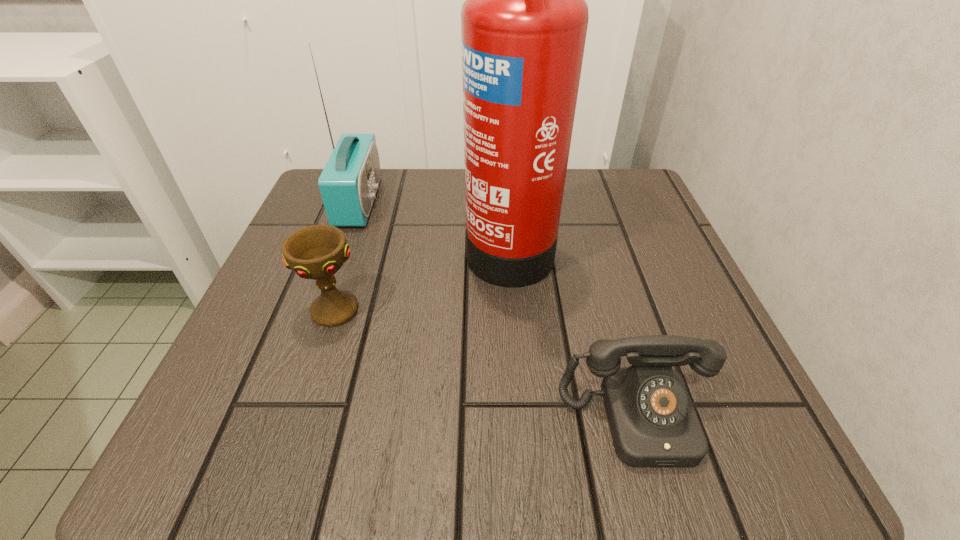
Where is `fire extinguisher located in the far edge section of the desktop`? The width and height of the screenshot is (960, 540). fire extinguisher located in the far edge section of the desktop is located at coordinates (523, 25).

Where is `radio receiver present at the far edge`? Image resolution: width=960 pixels, height=540 pixels. radio receiver present at the far edge is located at coordinates (348, 184).

You are a GUI agent. You are given a task and a screenshot of the screen. Output one action in this format:
    pyautogui.click(x=<x>, y=<y>)
    Task: Click on the object that is at the near edge
    The image size is (960, 540).
    Given the screenshot: What is the action you would take?
    pyautogui.click(x=653, y=422)

In order to click on radio receiver located at the left edge in this screenshot , I will do `click(348, 184)`.

You are a GUI agent. You are given a task and a screenshot of the screen. Output one action in this format:
    pyautogui.click(x=<x>, y=<y>)
    Task: Click on the chalice positioned at the left edge
    
    Given the screenshot: What is the action you would take?
    pyautogui.click(x=317, y=252)

At what (x,y) coordinates should I click in order to perform the action: click on object located at the right edge. Please return your answer as a coordinate pair (x, y). The width and height of the screenshot is (960, 540). Looking at the image, I should click on (653, 422).

This screenshot has height=540, width=960. Find the location of `object at the far left corner`. object at the far left corner is located at coordinates (348, 184).

Locate an element on the screen. object situated at the near right corner is located at coordinates (653, 422).

In the image, there is a desktop. At what (x,y) coordinates should I click in order to perform the action: click on vacant space at the far edge. Please return your answer as a coordinate pair (x, y). The height and width of the screenshot is (540, 960). Looking at the image, I should click on (430, 191).

Find the location of `free space at the near edge`. free space at the near edge is located at coordinates (322, 449).